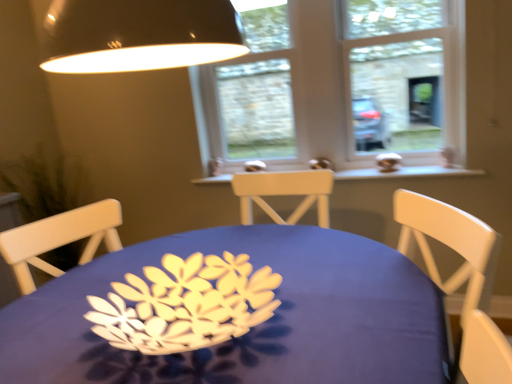
At what (x,y) coordinates should I click in order to perform the action: click on white plastic window frame at upper right. Please return your answer as a coordinate pair (x, y). The height and width of the screenshot is (384, 512). Looking at the image, I should click on (406, 76).

Describe the element at coordinates (405, 173) in the screenshot. I see `white wood window sill at center` at that location.

Where is `blue fabric table at center`? This screenshot has height=384, width=512. blue fabric table at center is located at coordinates (234, 313).

The width and height of the screenshot is (512, 384). I want to click on white plastic window frame at upper right, so click(x=406, y=76).

How many degrees apart are the facing directions of blue fabric table at center and white plastic window frame at upper right?

blue fabric table at center and white plastic window frame at upper right are facing 1.84 degrees away from each other.

The height and width of the screenshot is (384, 512). Find the location of `table that appears on the left of white plastic window frame at upper right`. table that appears on the left of white plastic window frame at upper right is located at coordinates (234, 313).

Is blue fabric table at center wider or thinner than white plastic window frame at upper right?

Clearly, blue fabric table at center has more width compared to white plastic window frame at upper right.

Considering the sizes of green matte plant at left and white plastic window frame at upper right in the image, is green matte plant at left wider or thinner than white plastic window frame at upper right?

Clearly, green matte plant at left has more width compared to white plastic window frame at upper right.

Which object is further away from the camera taking this photo, green matte plant at left or white plastic window frame at upper right?

white plastic window frame at upper right is further away from the camera.

From the image's perspective, which one is positioned higher, green matte plant at left or white plastic window frame at upper right?

white plastic window frame at upper right is shown above in the image.

In the scene shown: Who is bigger, green matte plant at left or white plastic window frame at upper right?

With larger size is green matte plant at left.

Can you confirm if clear glass window at center is smaller than blue fabric table at center?

Yes.

The width and height of the screenshot is (512, 384). I want to click on table that appears below the clear glass window at center (from the image's perspective), so click(x=234, y=313).

Can you confirm if clear glass window at center is thinner than white wood window sill at center?

Correct, the width of clear glass window at center is less than that of white wood window sill at center.

Is clear glass window at center beside white wood window sill at center?

clear glass window at center and white wood window sill at center are not in contact.

Is clear glass window at center smaller than white wood window sill at center?

Incorrect, clear glass window at center is not smaller in size than white wood window sill at center.

From the image's perspective, is clear glass window at center located above or below white wood window sill at center?

From the image's perspective, clear glass window at center appears above white wood window sill at center.

Which of these two, green matte plant at left or blue fabric table at center, is smaller?

With smaller size is green matte plant at left.

Considering the relative positions of green matte plant at left and blue fabric table at center in the image provided, is green matte plant at left behind blue fabric table at center?

Yes, green matte plant at left is behind blue fabric table at center.

You are a GUI agent. You are given a task and a screenshot of the screen. Output one action in this format:
    pyautogui.click(x=<x>, y=<y>)
    Task: Click on the plant above the blue fabric table at center (from a real-world perspective)
    This screenshot has width=512, height=384.
    Given the screenshot: What is the action you would take?
    (x=45, y=184)

From the image's perspective, which is above, green matte plant at left or blue fabric table at center?

green matte plant at left, from the image's perspective.

Consider the image. Considering the relative sizes of blue fabric table at center and green matte plant at left in the image provided, is blue fabric table at center taller than green matte plant at left?

Incorrect, the height of blue fabric table at center is not larger of that of green matte plant at left.

Is point (389, 289) closer or farther from the camera than point (67, 168)?

Clearly, point (389, 289) is closer to the camera than point (67, 168).

Is blue fabric table at center further to camera compared to green matte plant at left?

No, it is not.

Identify the location of plant behind the blue fabric table at center. (45, 184).

Is white wood window sill at center surrounding clear glass window at center?

No, clear glass window at center is located outside of white wood window sill at center.

Is white wood window sill at center wider than clear glass window at center?

Yes, white wood window sill at center is wider than clear glass window at center.

Who is more distant, white wood window sill at center or clear glass window at center?

clear glass window at center is further away from the camera.

Is point (450, 168) positioned behind point (215, 105)?

That is False.

In the image, there is a white plastic window frame at upper right. What are the coordinates of `table below it (from a real-world perspective)` in the screenshot? It's located at (234, 313).

What are the coordinates of `window frame on the right of green matte plant at left` in the screenshot? It's located at (406, 76).

Looking at the image, which one is located further to blue fabric table at center, clear glass window at center or white wood window sill at center?

Based on the image, clear glass window at center appears to be further to blue fabric table at center.

Considering their positions, is white wood window sill at center positioned further to clear glass window at center than blue fabric table at center?

blue fabric table at center is positioned further to the anchor clear glass window at center.

Estimate the real-world distances between objects in this image. Which object is closer to blue fabric table at center, green matte plant at left or clear glass window at center?

clear glass window at center is closer to blue fabric table at center.

Looking at the image, which one is located closer to blue fabric table at center, green matte plant at left or white plastic window frame at upper right?

white plastic window frame at upper right.

Which object lies nearer to the anchor point white plastic window frame at upper right, green matte plant at left or clear glass window at center?

clear glass window at center lies closer to white plastic window frame at upper right than the other object.

Looking at this image, based on their spatial positions, is green matte plant at left or white plastic window frame at upper right closer to clear glass window at center?

Based on the image, white plastic window frame at upper right appears to be nearer to clear glass window at center.

Which object lies further to the anchor point blue fabric table at center, white wood window sill at center or green matte plant at left?

Based on the image, green matte plant at left appears to be further to blue fabric table at center.

When comparing their distances from white plastic window frame at upper right, does blue fabric table at center or clear glass window at center seem further?

Based on the image, blue fabric table at center appears to be further to white plastic window frame at upper right.

The width and height of the screenshot is (512, 384). In order to click on window frame positioned between blue fabric table at center and clear glass window at center from near to far in this screenshot , I will do `click(406, 76)`.

Where is `plant between blue fabric table at center and clear glass window at center from front to back`? This screenshot has height=384, width=512. plant between blue fabric table at center and clear glass window at center from front to back is located at coordinates (45, 184).

You are a GUI agent. You are given a task and a screenshot of the screen. Output one action in this format:
    pyautogui.click(x=<x>, y=<y>)
    Task: Click on the window sill located between blue fabric table at center and clear glass window at center in the depth direction
    This screenshot has width=512, height=384.
    Given the screenshot: What is the action you would take?
    pyautogui.click(x=405, y=173)

This screenshot has width=512, height=384. I want to click on table between green matte plant at left and white plastic window frame at upper right in the horizontal direction, so click(x=234, y=313).